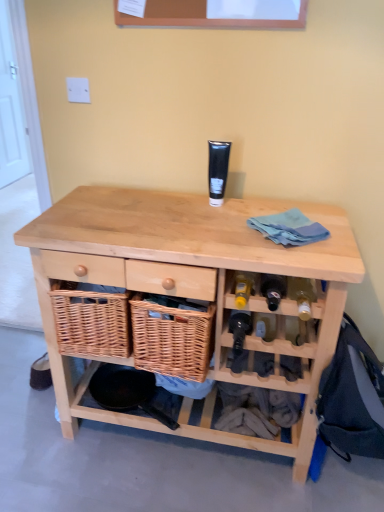
Question: Based on their positions, is translucent glass wine bottle at lower right, which appears as the second wine bottle when viewed from the left, located to the left or right of black matte tube at center?

Choices:
 (A) right
 (B) left

Answer: (A)

Question: Is translucent glass wine bottle at lower right, arranged as the second wine bottle when ordered from the bottom, wider or thinner than black matte tube at center?

Choices:
 (A) thin
 (B) wide

Answer: (B)

Question: Estimate the real-world distances between objects in this image. Which object is farther from the white painted wood door at left?

Choices:
 (A) translucent glass wine bottle at lower right, the first wine bottle from the top
 (B) shiny dark glass wine bottle at center, positioned as the first wine bottle in bottom-to-top order
 (C) black matte tube at center
 (D) natural wood table at center

Answer: (A)

Question: Which object is positioned farthest from the shiny dark glass wine bottle at center, which appears as the second wine bottle when viewed from the right?

Choices:
 (A) white painted wood door at left
 (B) natural wood table at center
 (C) black matte tube at center
 (D) translucent glass wine bottle at lower right, which appears as the second wine bottle when viewed from the left

Answer: (A)